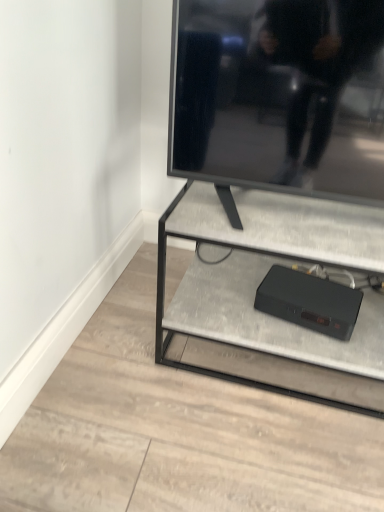
Image resolution: width=384 pixels, height=512 pixels. What are the coordinates of `empty space that is ontop of black plastic device at lower center (from a real-world perspective)` in the screenshot? It's located at (306, 285).